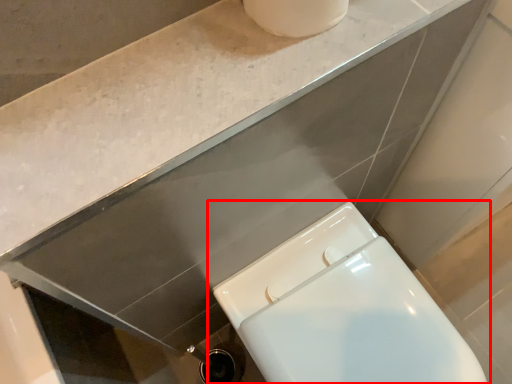
Question: From the image's perspective, considering the relative positions of toilet (annotated by the red box) and counter top in the image provided, where is toilet (annotated by the red box) located with respect to the staircase?

Choices:
 (A) below
 (B) above

Answer: (A)